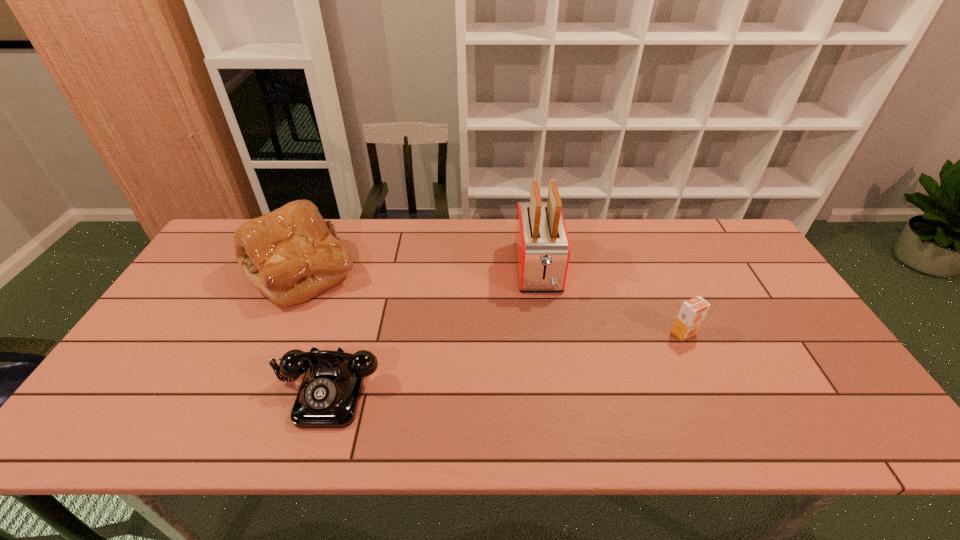
This screenshot has width=960, height=540. I want to click on bread at the far edge, so click(x=291, y=254).

I want to click on object present at the near edge, so click(x=328, y=397).

In order to click on object that is at the left edge in this screenshot , I will do `click(291, 254)`.

Find the location of `object that is at the far left corner`. object that is at the far left corner is located at coordinates (291, 254).

Identify the location of vacant space at the far edge of the desktop. (440, 246).

Where is `vacant space at the near edge of the desktop`? vacant space at the near edge of the desktop is located at coordinates (322, 431).

The image size is (960, 540). I want to click on vacant region at the left edge of the desktop, so click(151, 340).

The height and width of the screenshot is (540, 960). In the image, there is a desktop. Find the location of `vacant space at the right edge`. vacant space at the right edge is located at coordinates (795, 362).

The height and width of the screenshot is (540, 960). I want to click on free space at the far right corner of the desktop, so click(x=701, y=221).

Find the location of a particular element. The image size is (960, 540). vacant space in between the second tallest object and the nearest object is located at coordinates (315, 330).